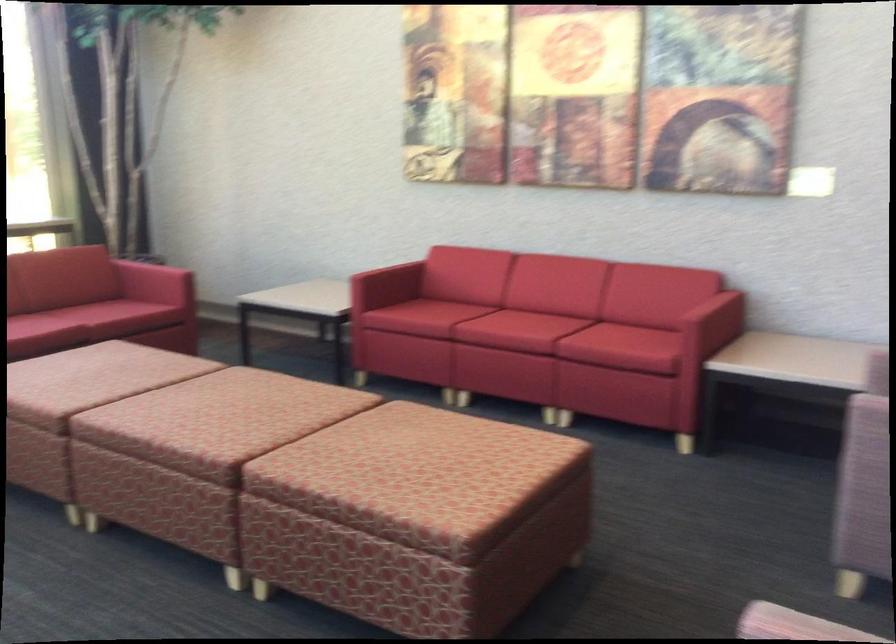
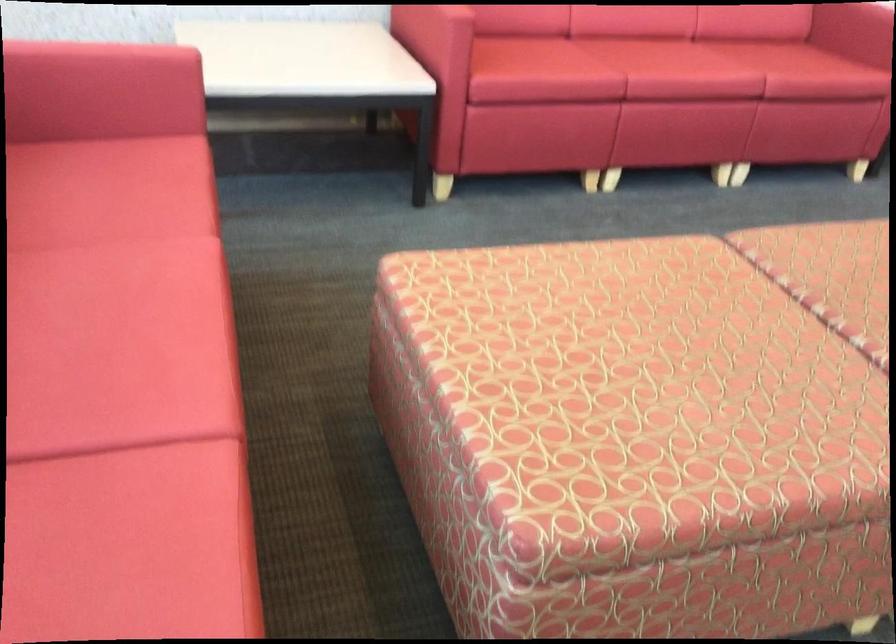
Locate, in the second image, the point that corresponds to the point at 517,319 in the first image.

(677, 62)